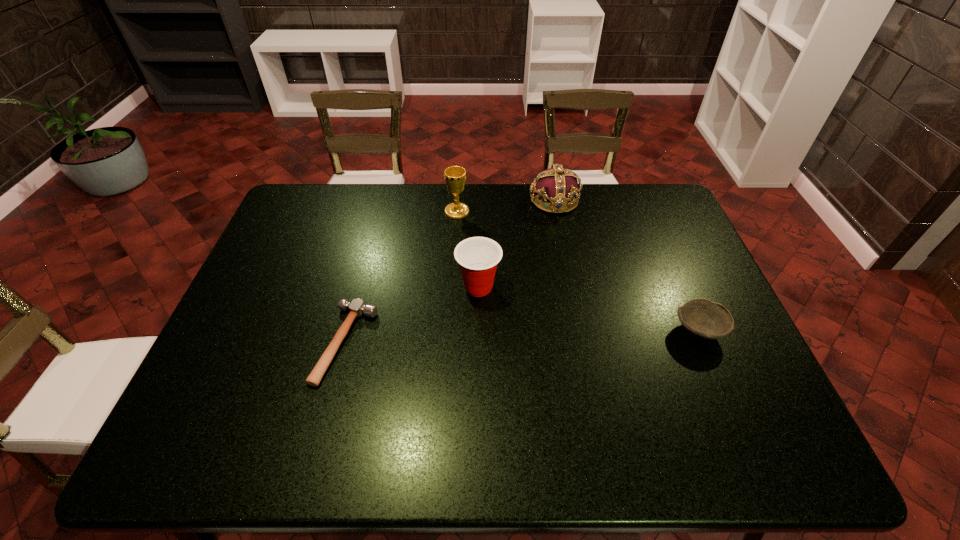
At what (x,y) coordinates should I click in order to perform the action: click on chalice. Please return your answer as a coordinate pair (x, y). This screenshot has width=960, height=540. Looking at the image, I should click on (455, 176).

Identify the location of the fourth object from left to right. [557, 185].

Find the location of a particular element. the third nearest object is located at coordinates (478, 257).

Locate an element on the screen. This screenshot has height=540, width=960. the rightmost object is located at coordinates 702,318.

The image size is (960, 540). In order to click on bowl in this screenshot , I will do pos(702,318).

Find the location of a particular element. hammer is located at coordinates (357, 308).

Locate an element on the screen. Image resolution: width=960 pixels, height=540 pixels. the leftmost object is located at coordinates (357, 308).

Identify the location of free space located 0.130m on the left of the chalice. Image resolution: width=960 pixels, height=540 pixels. (407, 212).

At what (x,y) coordinates should I click in order to perform the action: click on vacant space located on the right of the crown. Please return your answer as a coordinate pair (x, y). Looking at the image, I should click on (667, 200).

Image resolution: width=960 pixels, height=540 pixels. I want to click on free space located on the front of the cup, so click(478, 436).